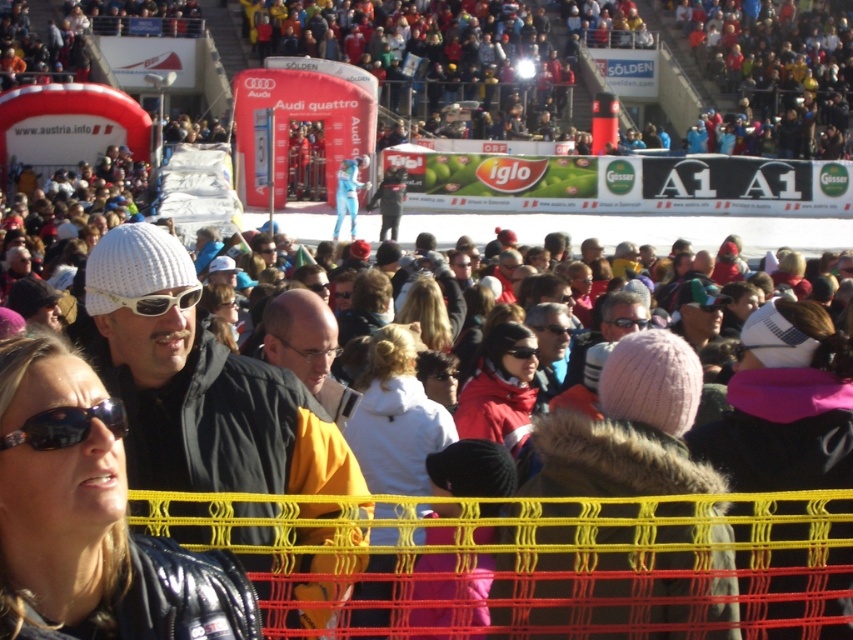
You are a photographer at the event and need to capture a photo of both the red fleece jacket at center and the black matte goggles at center. Since you want to ensure both are clearly visible, which object should you focus on first considering their sizes?

The red fleece jacket at center has a larger width than the black matte goggles at center, so you should focus on the red fleece jacket at center first to ensure it is in clear view before adjusting for the smaller goggles.

You are a photographer at the ski event. You need to take a photo of the red fleece jacket at center and the black matte goggles at center. Which object should you focus on first if you want to capture both in a single frame without moving the camera?

The red fleece jacket at center is below the black matte goggles at center, so you should focus on the black matte goggles at center first to ensure both objects are in the frame.